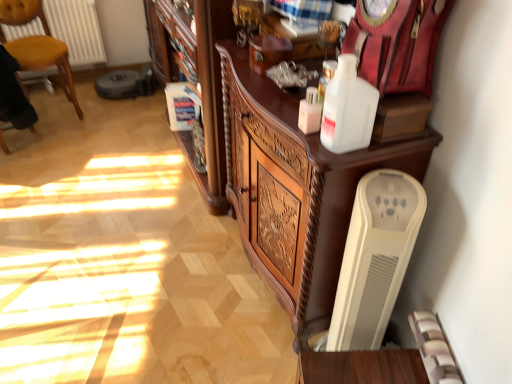
Identify the location of vacant space positioned to the left of wooden cabinet at center. (159, 280).